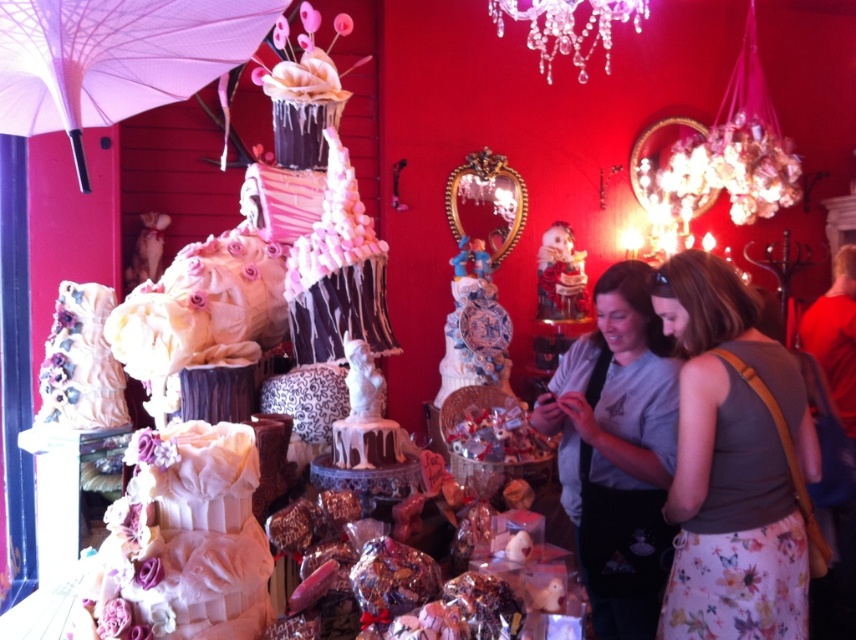
You are a customer in the bakery and want to take a photo of both the white fabric cake at center and the pink fabric umbrella at upper left. Since your camera has a fixed frame, you need to know which object is wider to adjust your focus. Which one is wider?

The pink fabric umbrella at upper left is wider than the white fabric cake at center.

You are standing in the bakery and want to take a photo of both the point at coordinates point (729, 609) and the point at coordinates point (669, 173). Which point should you focus on first to ensure both are in the frame?

Since point (729, 609) is in front of point 0.273, 0.783, you should focus on point (729, 609) first to ensure both are in the frame.